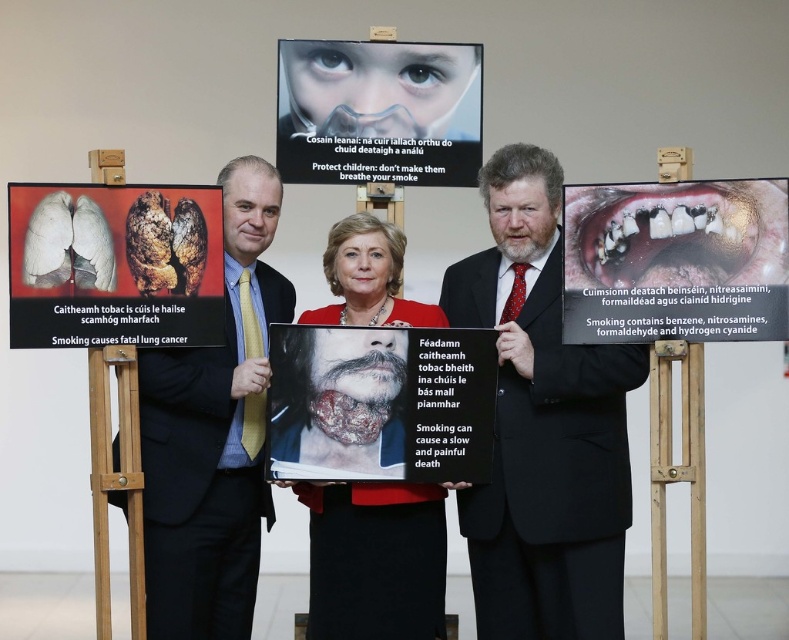
Is point (468, 362) more distant than point (414, 552)?

No, (468, 362) is in front of (414, 552).

In the scene shown: Is scarred skin poster at center below smooth skin face at center?

No, scarred skin poster at center is not below smooth skin face at center.

Find the location of a particular element. The width and height of the screenshot is (789, 640). scarred skin poster at center is located at coordinates (380, 403).

The image size is (789, 640). Identify the location of scarred skin poster at center. (380, 403).

Find the location of a particular element. Image resolution: width=789 pixels, height=640 pixels. smooth skin face at center is located at coordinates (376, 561).

Does smooth skin face at center have a lesser width compared to matte plastic mask at upper center?

Yes.

Who is more forward, (x=333, y=593) or (x=387, y=74)?

Point (x=333, y=593)

This screenshot has height=640, width=789. Find the location of `smooth skin face at center`. smooth skin face at center is located at coordinates (376, 561).

Is black suit at center to the left of scarred skin poster at center from the viewer's perspective?

No, black suit at center is not to the left of scarred skin poster at center.

How much distance is there between black suit at center and scarred skin poster at center?

20.84 inches

Between point (595, 397) and point (354, 458), which one is positioned behind?

The point (595, 397) is behind.

You are a GUI agent. You are given a task and a screenshot of the screen. Output one action in this format:
    pyautogui.click(x=<x>, y=<y>)
    Task: Click on the black suit at center
    Image resolution: width=789 pixels, height=640 pixels.
    Given the screenshot: What is the action you would take?
    pyautogui.click(x=541, y=426)